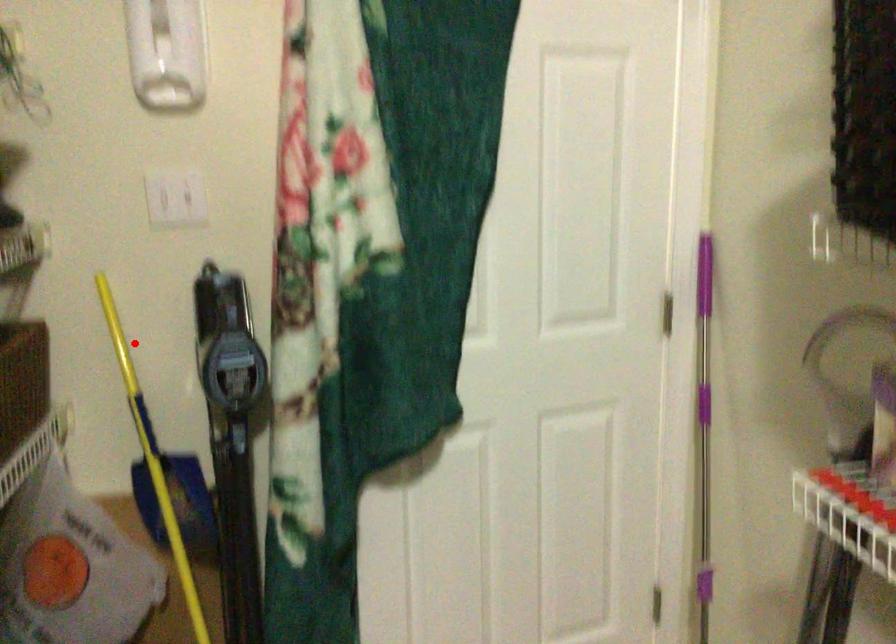
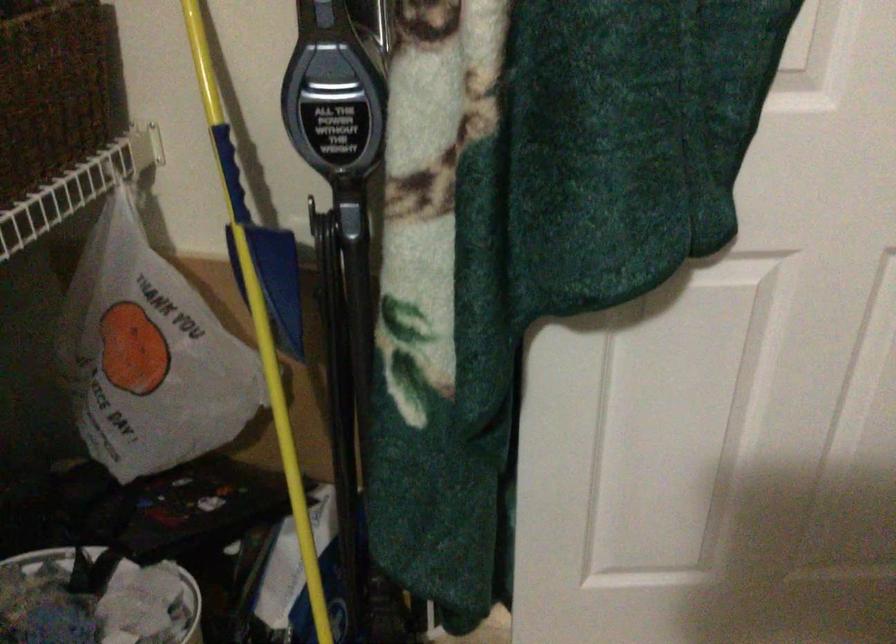
In the second image, find the point that corresponds to the highlighted location in the first image.

(213, 44)